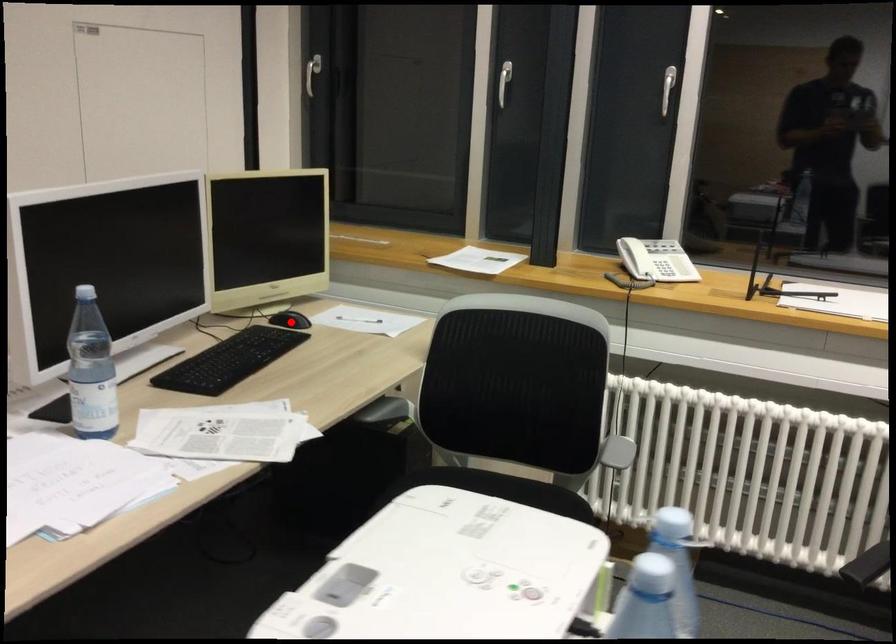
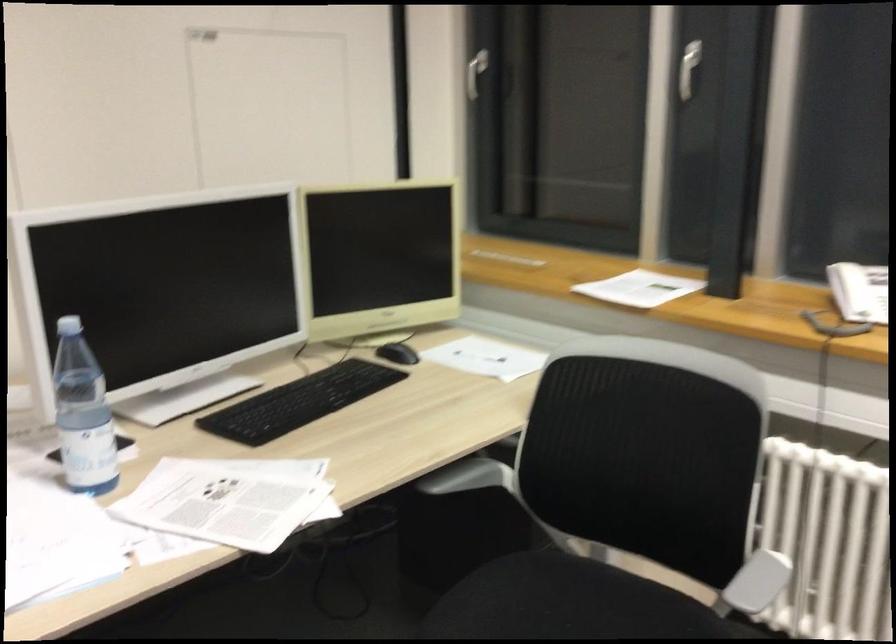
Find the pixel in the second image that matches the highlighted location in the first image.

(398, 353)